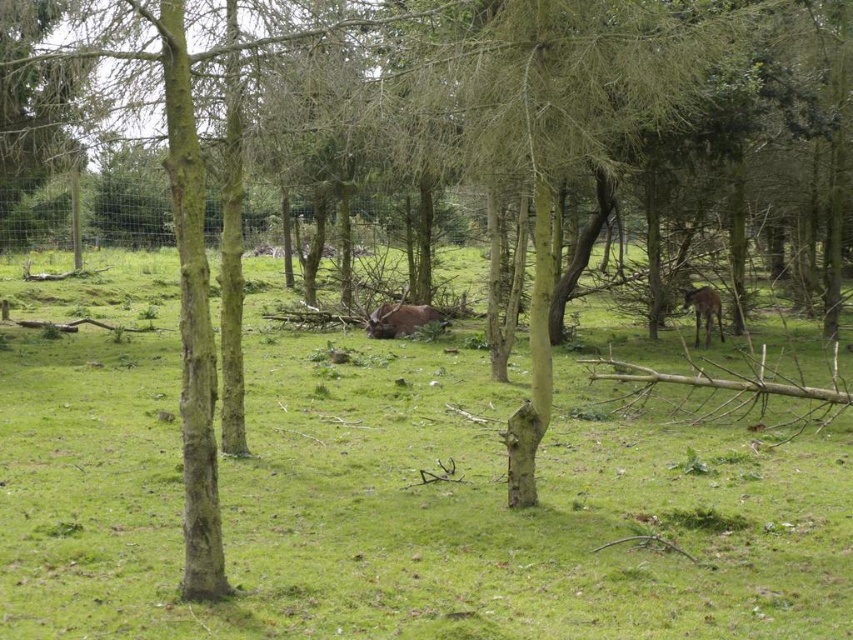
Does brown furry bull at center have a lesser width compared to brown furry deer at right?

Incorrect, brown furry bull at center's width is not less than brown furry deer at right's.

Is brown furry bull at center bigger than brown furry deer at right?

Incorrect, brown furry bull at center is not larger than brown furry deer at right.

Who is more forward, (418, 323) or (708, 294)?

Point (708, 294)

At what (x,y) coordinates should I click in order to perform the action: click on brown furry bull at center. Please return your answer as a coordinate pair (x, y). The height and width of the screenshot is (640, 853). Looking at the image, I should click on (401, 320).

Who is positioned more to the right, green grassy field at center or brown furry bull at center?

Positioned to the right is brown furry bull at center.

Can you confirm if green grassy field at center is bigger than brown furry bull at center?

Yes, green grassy field at center is bigger than brown furry bull at center.

The width and height of the screenshot is (853, 640). I want to click on green grassy field at center, so click(401, 504).

Find the location of a particular element. Image resolution: width=853 pixels, height=640 pixels. green grassy field at center is located at coordinates (401, 504).

Who is taller, green grassy field at center or brown furry deer at right?

green grassy field at center is taller.

Is green grassy field at center shorter than brown furry deer at right?

Incorrect, green grassy field at center's height does not fall short of brown furry deer at right's.

The width and height of the screenshot is (853, 640). Identify the location of green grassy field at center. (401, 504).